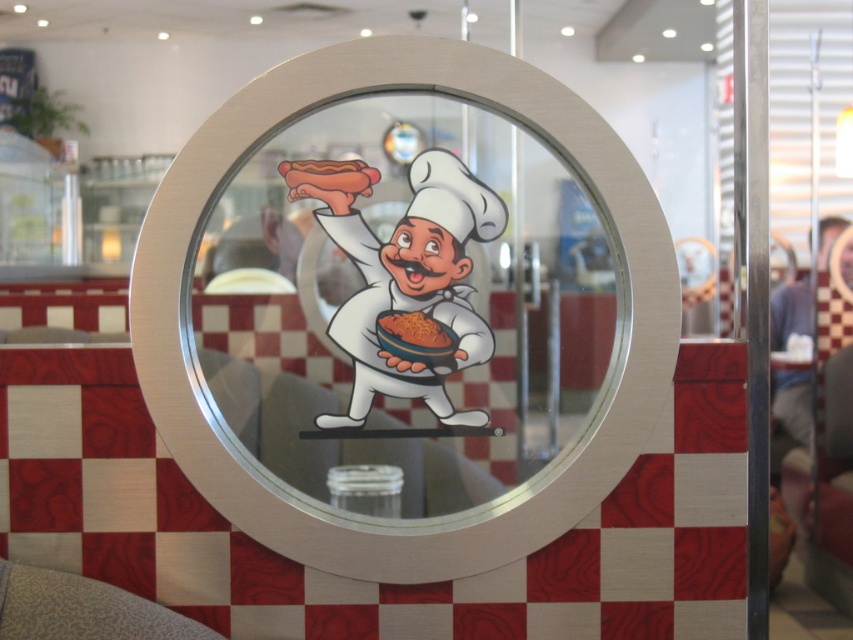
Is matte hot dog at upper center thinner than brown matte spaghetti at center?

In fact, matte hot dog at upper center might be wider than brown matte spaghetti at center.

Is matte hot dog at upper center smaller than brown matte spaghetti at center?

No, matte hot dog at upper center is not smaller than brown matte spaghetti at center.

Between point (311, 184) and point (407, 312), which one is positioned in front?

Point (311, 184)

Where is `matte hot dog at upper center`? matte hot dog at upper center is located at coordinates (329, 173).

Which of these two, white glossy chef at center or brown matte spaghetti at center, stands shorter?

Standing shorter between the two is brown matte spaghetti at center.

Is white glossy chef at center smaller than brown matte spaghetti at center?

Incorrect, white glossy chef at center is not smaller in size than brown matte spaghetti at center.

What do you see at coordinates (405, 276) in the screenshot? The image size is (853, 640). I see `white glossy chef at center` at bounding box center [405, 276].

Where is `white glossy chef at center`? white glossy chef at center is located at coordinates (405, 276).

Is matte glass sign at center bigger than brown matte spaghetti at center?

Yes.

Does matte glass sign at center have a greater height compared to brown matte spaghetti at center?

Correct, matte glass sign at center is much taller as brown matte spaghetti at center.

Between point (465, 554) and point (392, 324), which one is positioned in front?

Point (465, 554) is more forward.

I want to click on matte glass sign at center, so click(x=444, y=515).